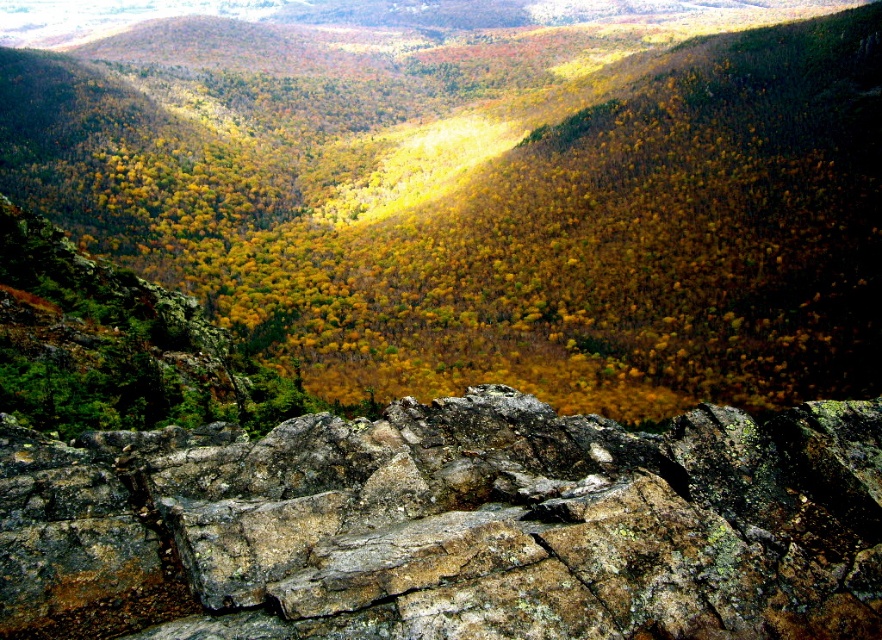
Question: Which object is farther from the camera taking this photo?

Choices:
 (A) rocky terrain at lower center
 (B) rusty rock at bottom

Answer: (A)

Question: Which of the following is the closest to the observer?

Choices:
 (A) (730, 246)
 (B) (422, 627)

Answer: (B)

Question: Which of the following is the farthest from the observer?

Choices:
 (A) rusty rock at bottom
 (B) rocky terrain at lower center

Answer: (B)

Question: Does rocky terrain at lower center have a smaller size compared to rusty rock at bottom?

Choices:
 (A) no
 (B) yes

Answer: (A)

Question: Can you confirm if rocky terrain at lower center is wider than rusty rock at bottom?

Choices:
 (A) yes
 (B) no

Answer: (A)

Question: Is rocky terrain at lower center further to camera compared to rusty rock at bottom?

Choices:
 (A) yes
 (B) no

Answer: (A)